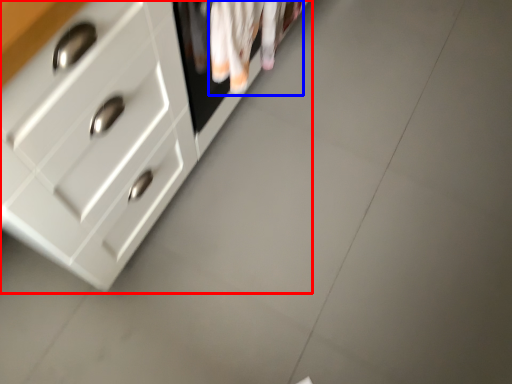
Question: Which point is closer to the camera, chest of drawers (highlighted by a red box) or laundry (highlighted by a blue box)?

Choices:
 (A) chest of drawers
 (B) laundry

Answer: (A)